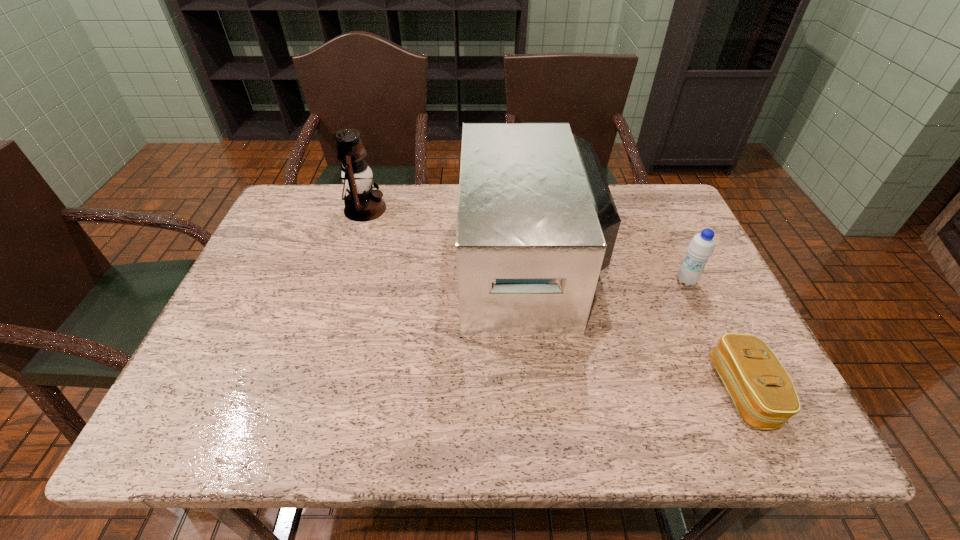
The image size is (960, 540). I want to click on lantern, so click(x=362, y=203).

You are a GUI agent. You are given a task and a screenshot of the screen. Output one action in this format:
    pyautogui.click(x=<x>, y=<y>)
    Task: Click on the microwave oven
    
    Given the screenshot: What is the action you would take?
    pyautogui.click(x=536, y=223)

Identify the location of the third tallest object. (701, 247).

You are a GUI agent. You are given a task and a screenshot of the screen. Output one action in this format:
    pyautogui.click(x=<x>, y=<y>)
    Task: Click on the clutch bag
    The image size is (960, 540).
    Given the screenshot: What is the action you would take?
    pyautogui.click(x=762, y=391)

Find the location of a particular element. the nearest object is located at coordinates (762, 391).

Locate an element on the screen. The width and height of the screenshot is (960, 540). free location located on the side of the leftmost object, there is a wick adjustment knob is located at coordinates (449, 209).

At what (x,y) coordinates should I click in order to perform the action: click on vacant space located on the front-facing side of the third object from right to left. Please return your answer as a coordinate pair (x, y). Image resolution: width=960 pixels, height=540 pixels. Looking at the image, I should click on (421, 264).

At what (x,y) coordinates should I click in order to perform the action: click on free region located 0.180m on the front-facing side of the third object from right to left. Please return your answer as a coordinate pair (x, y). Looking at the image, I should click on (395, 264).

Image resolution: width=960 pixels, height=540 pixels. What are the coordinates of `free space located 0.380m on the front-facing side of the third object from right to left` in the screenshot? It's located at (318, 264).

At what (x,y) coordinates should I click in order to perform the action: click on vacant space located 0.120m on the back of the second shortest object. Please return your answer as a coordinate pair (x, y). This screenshot has height=540, width=960. Looking at the image, I should click on (668, 243).